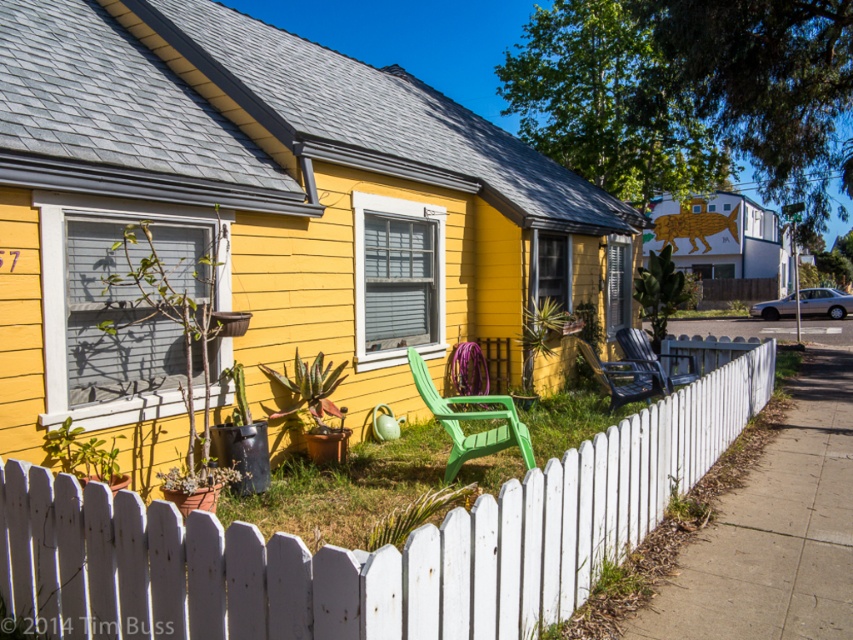
Question: Which of the following is the farthest from the observer?

Choices:
 (A) (614, 369)
 (B) (144, 532)
 (C) (647, 368)

Answer: (A)

Question: Based on their relative distances, which object is farther from the matte blue plastic chair at center?

Choices:
 (A) white picket fence at center
 (B) green plastic chair at center
 (C) black plastic chair at center

Answer: (A)

Question: In this image, where is white picket fence at center located relative to black plastic chair at center?

Choices:
 (A) below
 (B) above

Answer: (A)

Question: Which of the following is the closest to the observer?

Choices:
 (A) black plastic chair at center
 (B) matte blue plastic chair at center

Answer: (A)

Question: From the image, what is the correct spatial relationship of black plastic chair at center in relation to matte blue plastic chair at center?

Choices:
 (A) above
 (B) below

Answer: (B)

Question: Is the position of green plastic chair at center less distant than that of matte blue plastic chair at center?

Choices:
 (A) no
 (B) yes

Answer: (B)